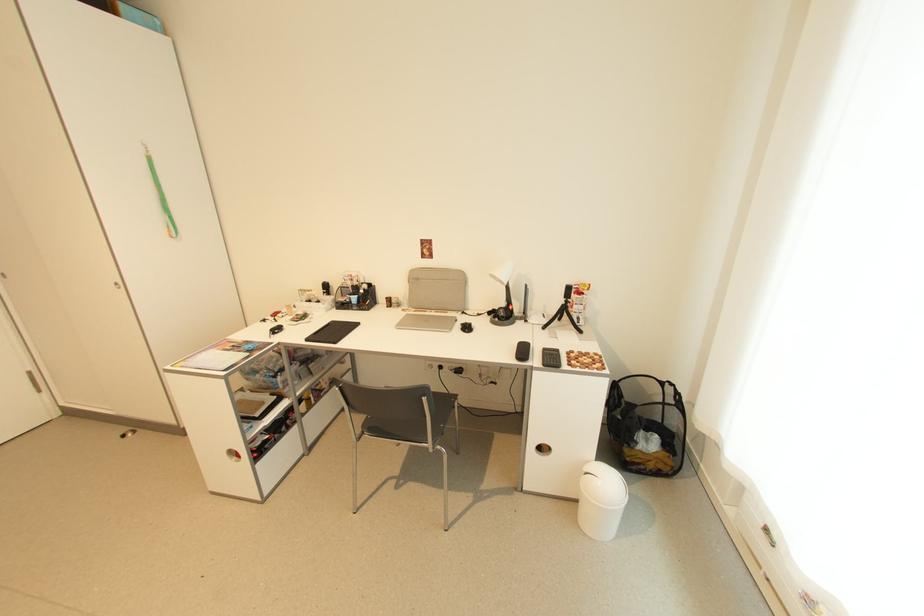
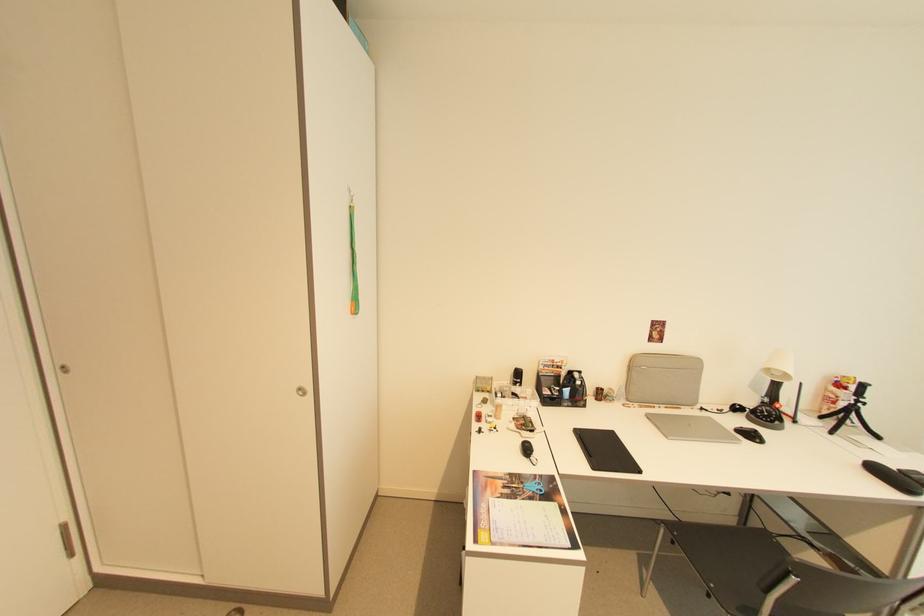
The point at (419, 280) is marked in the first image. Where is the corresponding point in the second image?

(638, 366)